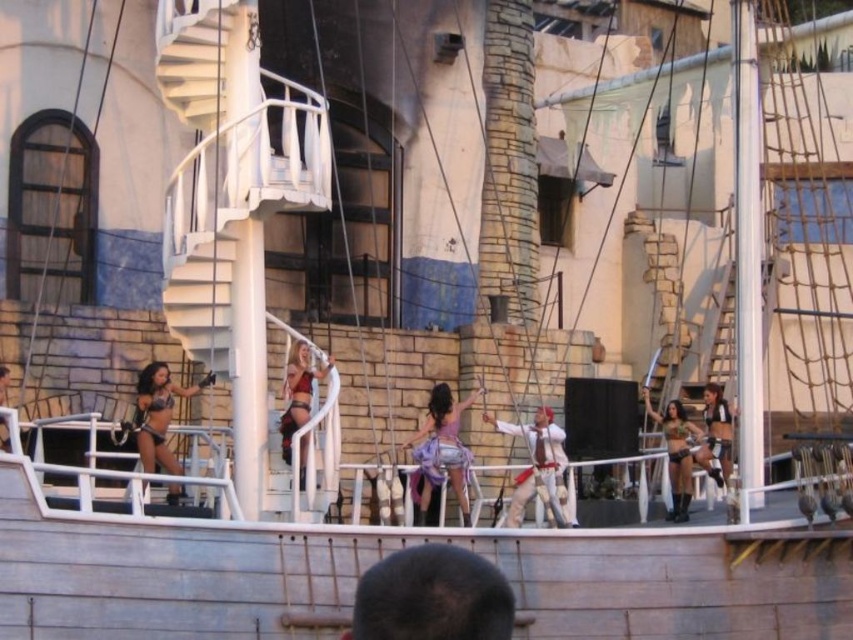
Can you confirm if purple satin dress at center is wider than shiny metallic bikini at left?

No.

Based on the photo, who is more forward, (456, 429) or (165, 417)?

Point (165, 417)

Which is behind, point (461, 445) or point (154, 420)?

The point (461, 445) is behind.

This screenshot has height=640, width=853. Find the location of `purple satin dress at center`. purple satin dress at center is located at coordinates click(x=440, y=449).

In the scene shown: Can you confirm if reddish-brown leather vest at center is positioned above shiny silver armor at right?

No.

Who is taller, reddish-brown leather vest at center or shiny silver armor at right?

reddish-brown leather vest at center

Locate an element on the screen. This screenshot has height=640, width=853. reddish-brown leather vest at center is located at coordinates (535, 461).

Who is more distant from viewer, (x=648, y=390) or (x=287, y=438)?

The point (x=648, y=390) is behind.

Between point (670, 509) and point (300, 451), which one is positioned in front?

Positioned in front is point (300, 451).

Where is `satin gold bikini at center`? This screenshot has height=640, width=853. satin gold bikini at center is located at coordinates (676, 452).